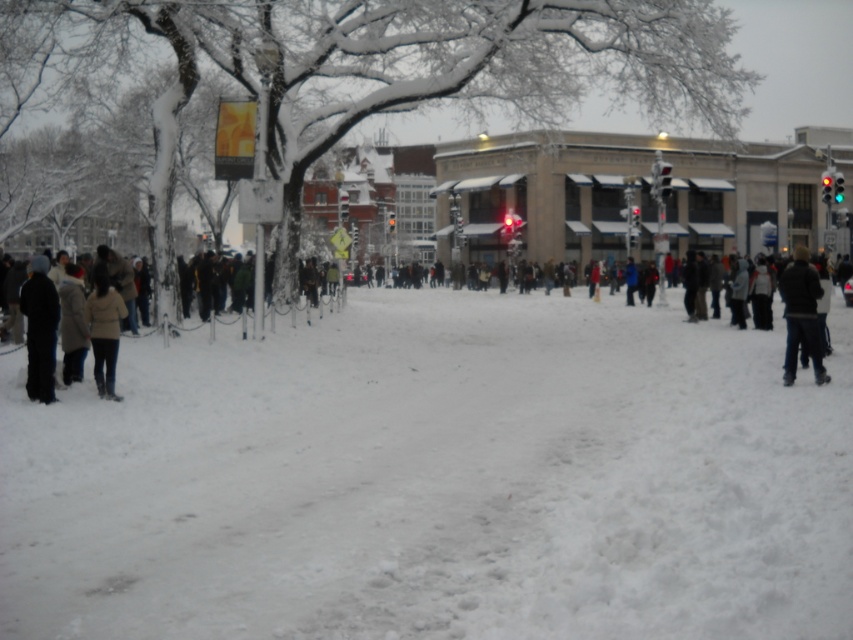
Question: Can you confirm if black matte coat at left is positioned below light beige jacket at lower left?

Choices:
 (A) yes
 (B) no

Answer: (B)

Question: Does black matte coat at left appear on the left side of dark blue jacket at right?

Choices:
 (A) no
 (B) yes

Answer: (B)

Question: Considering the real-world distances, which object is closest to the dark blue jacket at right?

Choices:
 (A) dark gray coat at left
 (B) white fluffy snow at center
 (C) black matte coat at left

Answer: (B)

Question: Which object appears closest to the camera in this image?

Choices:
 (A) white fluffy snow at center
 (B) dark blue jacket at right

Answer: (A)

Question: Considering the real-world distances, which object is closest to the black matte coat at left?

Choices:
 (A) white fluffy snow at center
 (B) dark blue jacket at right
 (C) light beige jacket at lower left

Answer: (C)

Question: Is dark gray coat at left further to camera compared to light beige jacket at lower left?

Choices:
 (A) no
 (B) yes

Answer: (A)